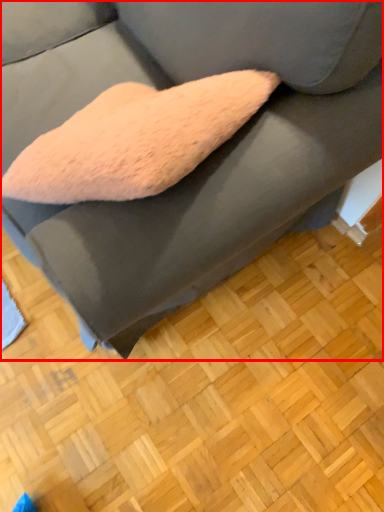
Question: From the image, what is the correct spatial relationship of studio couch (annotated by the red box) in relation to hardwood?

Choices:
 (A) right
 (B) left

Answer: (B)